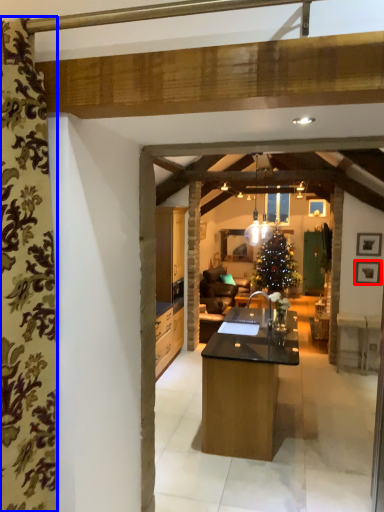
Question: Which object appears closest to the camera in this image, picture frame (highlighted by a red box) or curtain (highlighted by a blue box)?

Choices:
 (A) picture frame
 (B) curtain

Answer: (B)